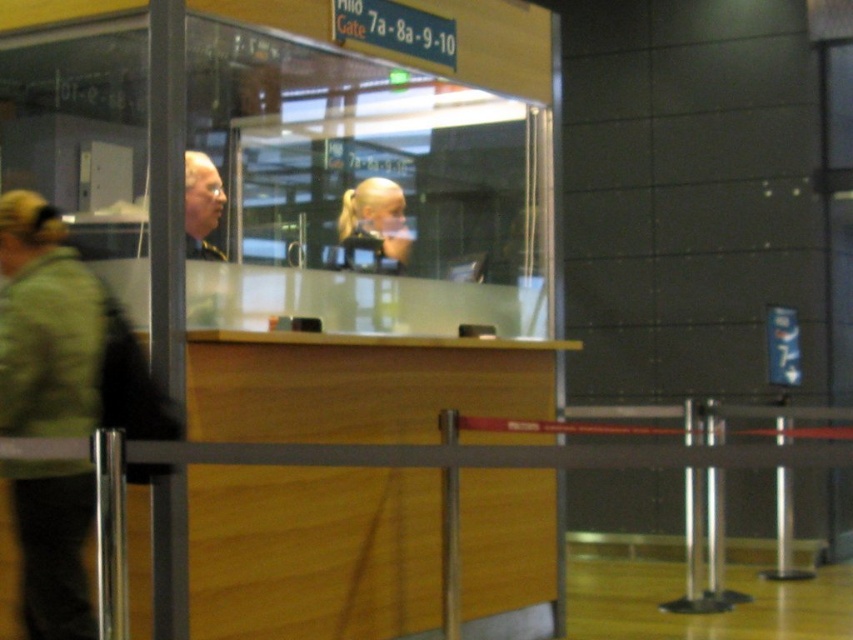
Looking at this image, you are a traveler standing at the counter at Gate 7a. You notice a green fabric jacket at left and a matte black hair at center. Which object is wider?

The green fabric jacket at left is wider than the matte black hair at center.

You are standing at the entrance of the airport counter area. You need to locate the green fabric jacket at left. Based on its 2D coordinates, which direction should you look relative to your current position?

The green fabric jacket at left is located at the lower left area since its coordinates are closer to the bottom left corner of the scene. You should look to your lower left direction to find it.

You are a traveler at the airport and want to ask the staff behind the counter about your gate. You notice the green fabric jacket at left and the blonde hair ponytail at center. Which object is closer to you from your current position?

The green fabric jacket at left is positioned under the blonde hair ponytail at center, meaning the blonde hair ponytail at center is closer to you.